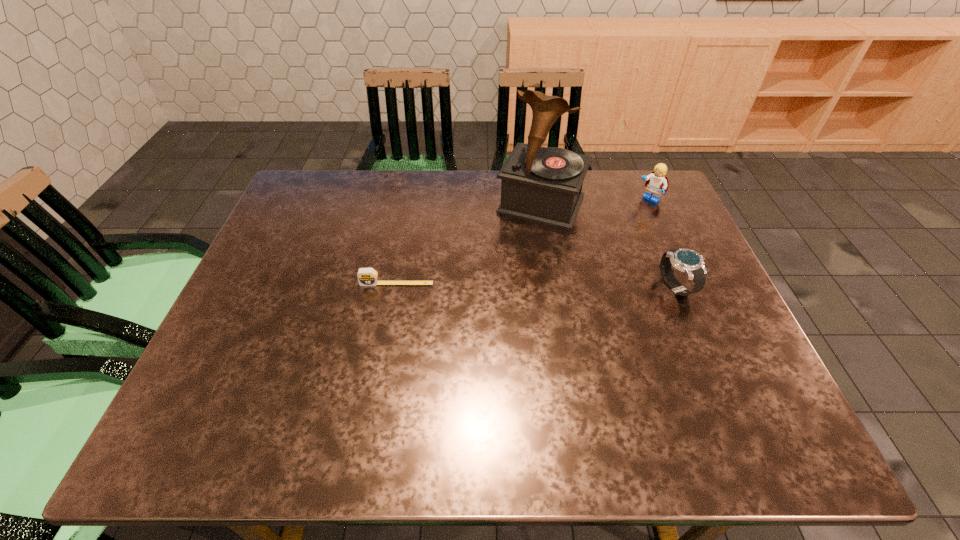
You are a GUI agent. You are given a task and a screenshot of the screen. Output one action in this format:
    pyautogui.click(x=<x>, y=<y>)
    Task: Click on the vacant space that satisfies the following two spatial constraints: 1. at the front of the second shortest object with the tape extended; 2. on the right side of the shortest object
    Image resolution: width=960 pixels, height=540 pixels.
    Given the screenshot: What is the action you would take?
    pyautogui.click(x=396, y=287)